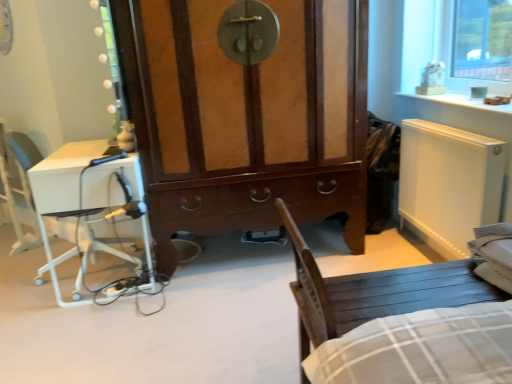
Locate an element on the screen. free spot below brown wood cabinet at center (from a real-world perspective) is located at coordinates (233, 255).